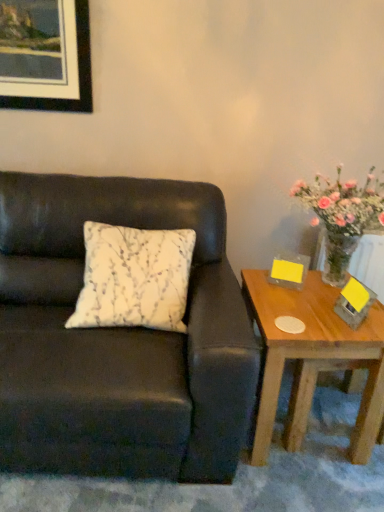
Question: From a real-world perspective, is wooden table at right positioned above or below matte black picture frame at upper left?

Choices:
 (A) above
 (B) below

Answer: (B)

Question: In terms of size, does wooden table at right appear bigger or smaller than matte black picture frame at upper left?

Choices:
 (A) big
 (B) small

Answer: (A)

Question: Based on their relative distances, which object is nearer to the matte black picture frame at upper left?

Choices:
 (A) wooden table at right
 (B) matte black couch at left
 (C) white printed cushion at center

Answer: (B)

Question: Estimate the real-world distances between objects in this image. Which object is closer to the matte black picture frame at upper left?

Choices:
 (A) matte black couch at left
 (B) white printed cushion at center
 (C) wooden table at right

Answer: (A)